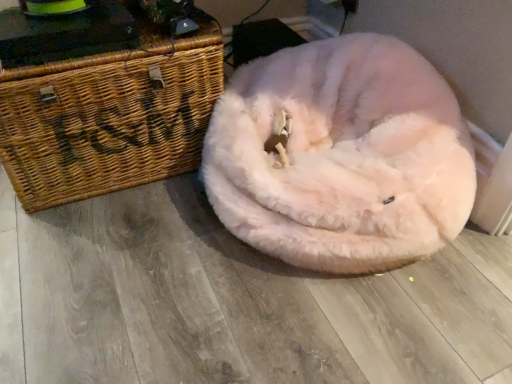
Where is `fluffy pink dog bed at center`? fluffy pink dog bed at center is located at coordinates (341, 156).

Describe the element at coordinates (341, 156) in the screenshot. The width and height of the screenshot is (512, 384). I see `fluffy pink dog bed at center` at that location.

This screenshot has width=512, height=384. I want to click on woven wood chest at left, so point(106,119).

Image resolution: width=512 pixels, height=384 pixels. Describe the element at coordinates (106, 119) in the screenshot. I see `woven wood chest at left` at that location.

You are a GUI agent. You are given a task and a screenshot of the screen. Output one action in this format:
    pyautogui.click(x=<x>, y=<y>)
    Task: Click on the fluffy pink dog bed at center
    Image resolution: width=512 pixels, height=384 pixels.
    Given the screenshot: What is the action you would take?
    pyautogui.click(x=341, y=156)

Is fluffy pink dog bed at center to the left of woven wood chest at left from the viewer's perspective?

Incorrect, fluffy pink dog bed at center is not on the left side of woven wood chest at left.

From the picture: Considering the relative positions of fluffy pink dog bed at center and woven wood chest at left in the image provided, is fluffy pink dog bed at center in front of woven wood chest at left?

Yes, fluffy pink dog bed at center is in front of woven wood chest at left.

Which point is more distant from viewer, (345, 37) or (143, 112)?

The point (345, 37) is more distant.

From the image's perspective, is fluffy pink dog bed at center positioned above or below woven wood chest at left?

Clearly, from the image's perspective, fluffy pink dog bed at center is below woven wood chest at left.

From a real-world perspective, between fluffy pink dog bed at center and woven wood chest at left, who is vertically higher?

In real-world perspective, woven wood chest at left is above.

Is fluffy pink dog bed at center wider or thinner than woven wood chest at left?

Considering their sizes, fluffy pink dog bed at center looks broader than woven wood chest at left.

Considering the relative sizes of fluffy pink dog bed at center and woven wood chest at left in the image provided, is fluffy pink dog bed at center taller than woven wood chest at left?

No, fluffy pink dog bed at center is not taller than woven wood chest at left.

Does fluffy pink dog bed at center have a larger size compared to woven wood chest at left?

Indeed, fluffy pink dog bed at center has a larger size compared to woven wood chest at left.

Is woven wood chest at left located within fluffy pink dog bed at center?

No, woven wood chest at left is not inside fluffy pink dog bed at center.

Is there a large distance between fluffy pink dog bed at center and woven wood chest at left?

fluffy pink dog bed at center is actually quite close to woven wood chest at left.

Is woven wood chest at left at the back of fluffy pink dog bed at center?

fluffy pink dog bed at center does not have its back to woven wood chest at left.

This screenshot has height=384, width=512. Find the location of `furniture behind the fluffy pink dog bed at center`. furniture behind the fluffy pink dog bed at center is located at coordinates (106, 119).

Does woven wood chest at left appear on the left side of fluffy pink dog bed at center?

Correct, you'll find woven wood chest at left to the left of fluffy pink dog bed at center.

Which object is further away from the camera, woven wood chest at left or fluffy pink dog bed at center?

Positioned behind is woven wood chest at left.

Considering the points (187, 55) and (418, 209), which point is in front, point (187, 55) or point (418, 209)?

The point (418, 209) is more forward.

From the image's perspective, between woven wood chest at left and fluffy pink dog bed at center, who is located below?

From the image's view, fluffy pink dog bed at center is below.

From a real-world perspective, which is physically above, woven wood chest at left or fluffy pink dog bed at center?

In real-world perspective, woven wood chest at left is above.

Looking at this image, considering the relative sizes of woven wood chest at left and fluffy pink dog bed at center in the image provided, is woven wood chest at left wider than fluffy pink dog bed at center?

Incorrect, the width of woven wood chest at left does not surpass that of fluffy pink dog bed at center.

Which of these two, woven wood chest at left or fluffy pink dog bed at center, stands shorter?

fluffy pink dog bed at center.

Considering the sizes of objects woven wood chest at left and fluffy pink dog bed at center in the image provided, who is bigger, woven wood chest at left or fluffy pink dog bed at center?

fluffy pink dog bed at center.

Is woven wood chest at left positioned beyond the bounds of fluffy pink dog bed at center?

Yes, woven wood chest at left is outside of fluffy pink dog bed at center.

Can you see woven wood chest at left touching fluffy pink dog bed at center?

No, woven wood chest at left is not touching fluffy pink dog bed at center.

Is woven wood chest at left turned away from fluffy pink dog bed at center?

woven wood chest at left is not turned away from fluffy pink dog bed at center.

Based on the photo, can you tell me how much woven wood chest at left and fluffy pink dog bed at center differ in facing direction?

90 degrees.

Locate an element on the screen. The height and width of the screenshot is (384, 512). furniture above the fluffy pink dog bed at center (from the image's perspective) is located at coordinates (106, 119).

Where is `dog bed that is on the right side of woven wood chest at left`? The height and width of the screenshot is (384, 512). dog bed that is on the right side of woven wood chest at left is located at coordinates (341, 156).

The width and height of the screenshot is (512, 384). What are the coordinates of `furniture that appears above the fluffy pink dog bed at center (from a real-world perspective)` in the screenshot? It's located at click(x=106, y=119).